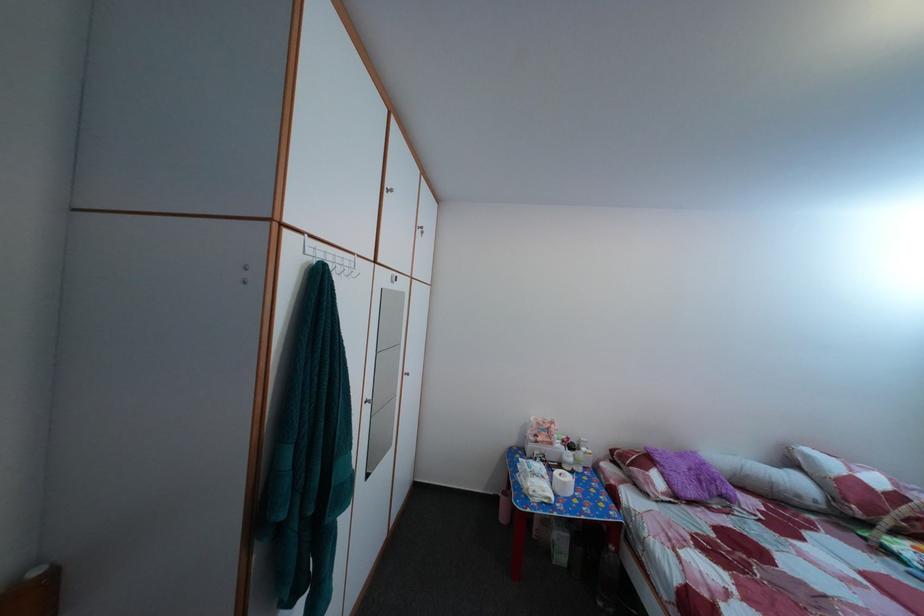
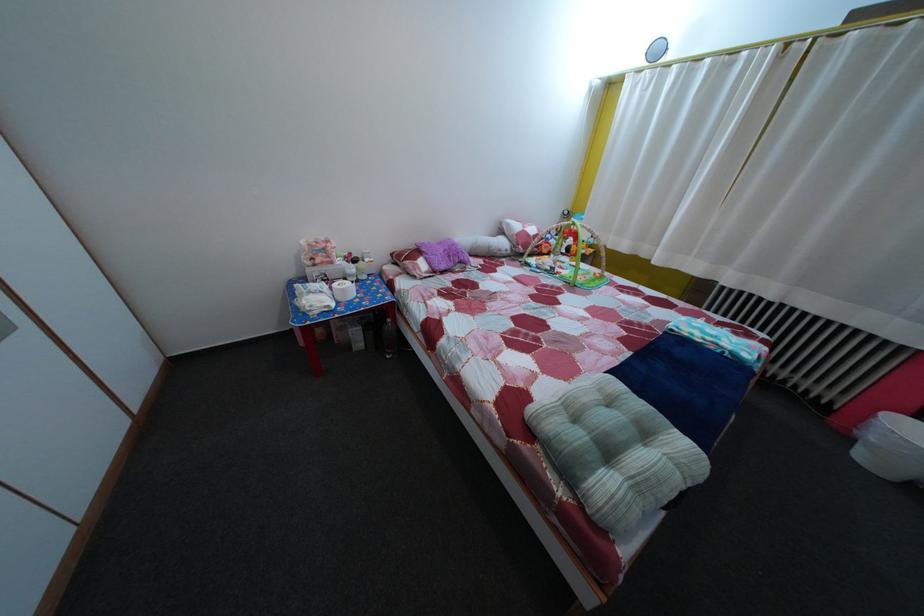
Where in the second image is the point corresponding to (x=553, y=464) from the first image?

(335, 284)